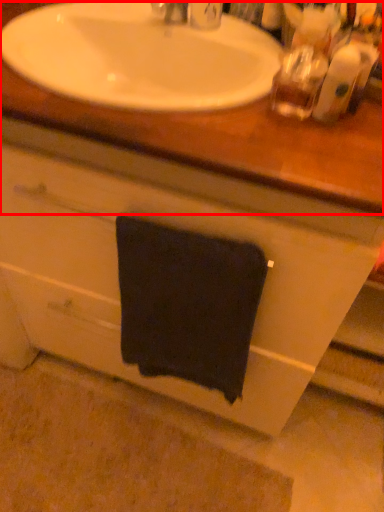
Question: From the image's perspective, what is the correct spatial relationship of counter top (annotated by the red box) in relation to towel/napkin?

Choices:
 (A) below
 (B) above

Answer: (B)